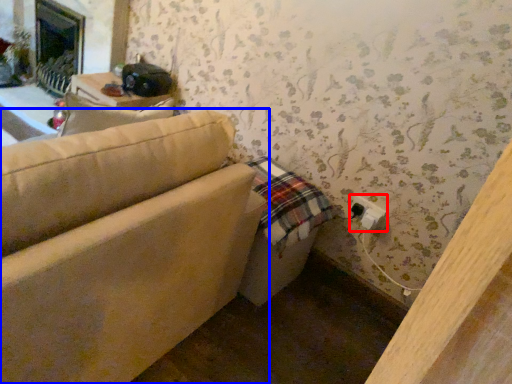
Question: Which object is further to the camera taking this photo, electric outlet (highlighted by a red box) or studio couch (highlighted by a blue box)?

Choices:
 (A) electric outlet
 (B) studio couch

Answer: (A)